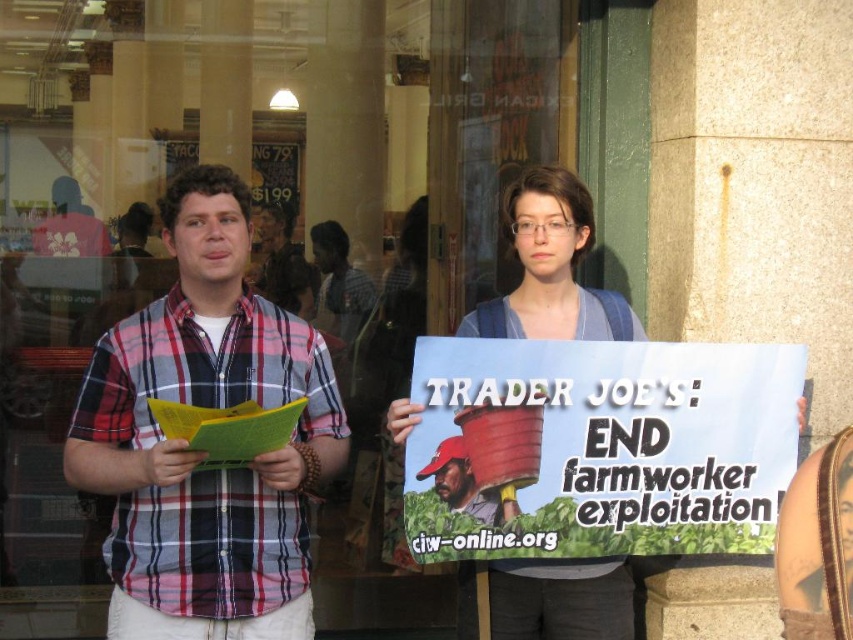
Where is `blue denim shirt at center`? blue denim shirt at center is located at coordinates (550, 268).

Can you confirm if blue denim shirt at center is positioned below brown leather hat at center?

No.

Where is `blue denim shirt at center`? The image size is (853, 640). blue denim shirt at center is located at coordinates (550, 268).

Between plaid cotton shirt at left and blue denim shirt at center, which one appears on the left side from the viewer's perspective?

plaid cotton shirt at left

Who is higher up, plaid cotton shirt at left or blue denim shirt at center?

blue denim shirt at center is above.

This screenshot has height=640, width=853. Find the location of `plaid cotton shirt at left`. plaid cotton shirt at left is located at coordinates (199, 451).

Between plaid cotton shirt at left and brown leather hat at center, which one is positioned higher?

plaid cotton shirt at left is higher up.

Can you confirm if plaid cotton shirt at left is taller than brown leather hat at center?

Indeed, plaid cotton shirt at left has a greater height compared to brown leather hat at center.

Between point (142, 602) and point (489, 497), which one is positioned behind?

Point (489, 497)

Find the location of `plaid cotton shirt at left`. plaid cotton shirt at left is located at coordinates (199, 451).